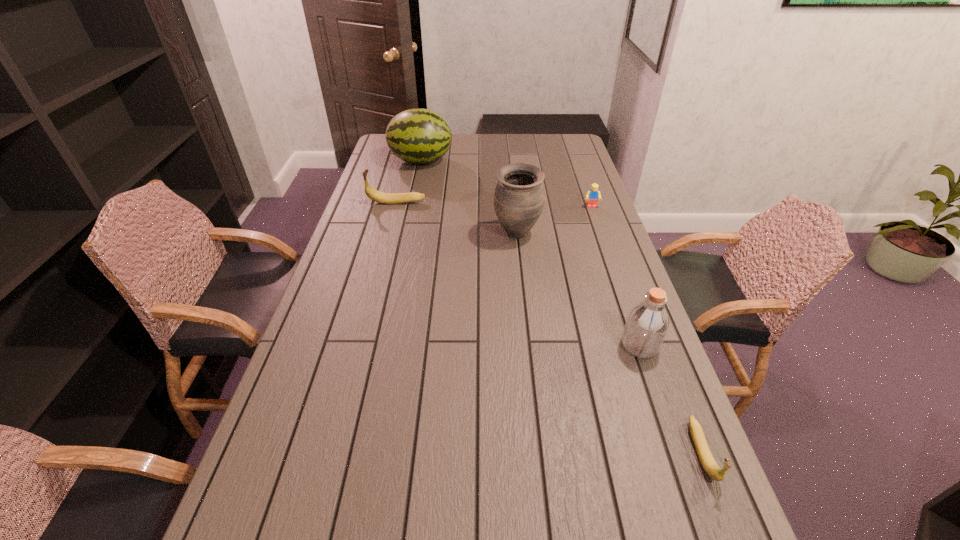
To make them evenly spaced by inserting another banana among them, please locate a vacant spot for this new banana. Please provide its 2D coordinates. Your answer should be formatted as a tuple, i.e. [(x, y)], where the tuple contains the x and y coordinates of a point satisfying the conditions above.

[(505, 291)]